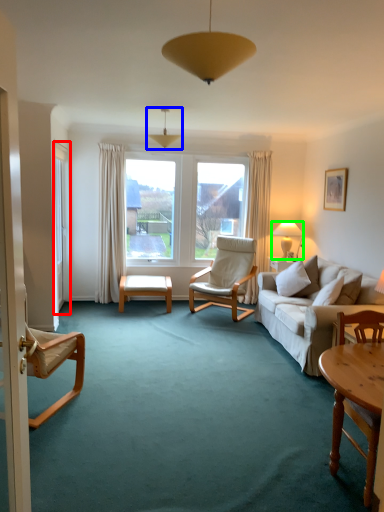
Question: Which is farther away from screen door (highlighted by a red box)? lamp (highlighted by a blue box) or lamp (highlighted by a green box)?

Choices:
 (A) lamp
 (B) lamp

Answer: (B)